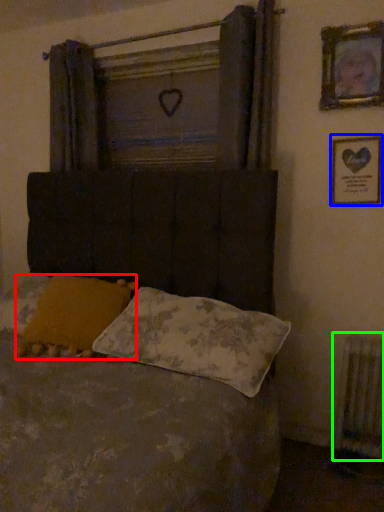
Question: Estimate the real-world distances between objects in this image. Which object is farther from pillow (highlighted by a red box), picture frame (highlighted by a blue box) or radiator (highlighted by a green box)?

Choices:
 (A) picture frame
 (B) radiator

Answer: (B)